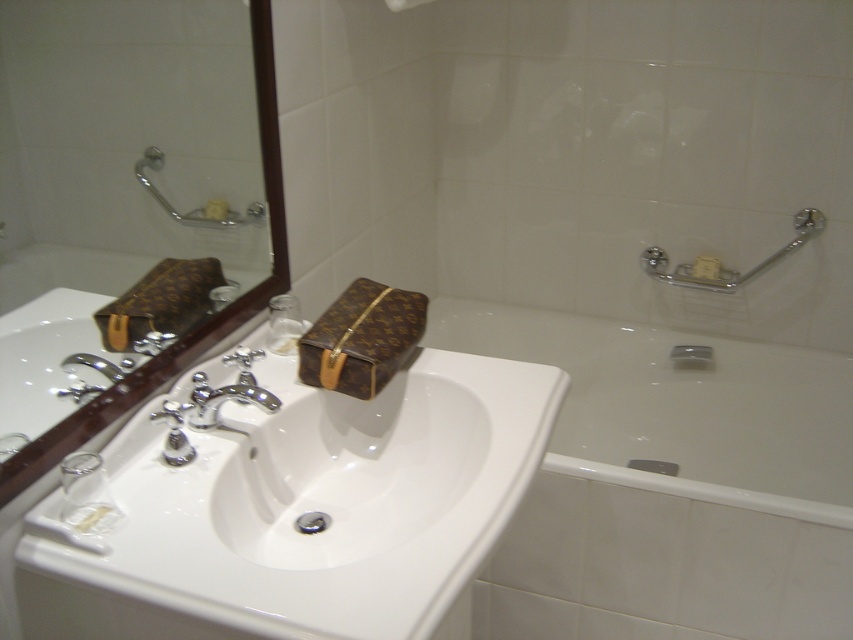
Question: Where is brown leather mirror at upper left located in relation to matte brown towel bar at upper center in the image?

Choices:
 (A) left
 (B) right

Answer: (A)

Question: Among these objects, which one is nearest to the camera?

Choices:
 (A) white matte soap at right
 (B) white glossy sink at center
 (C) chrome metallic grab bar at upper right
 (D) yellow matte soap at upper center

Answer: (B)

Question: Which of the following is the closest to the observer?

Choices:
 (A) (801, 240)
 (B) (241, 529)
 (C) (709, 260)
 (D) (387, 6)

Answer: (B)

Question: Is the position of brown leather mirror at upper left more distant than that of yellow matte soap at upper center?

Choices:
 (A) no
 (B) yes

Answer: (A)

Question: Does white glossy bathtub at lower right have a greater width compared to brown leather mirror at upper left?

Choices:
 (A) yes
 (B) no

Answer: (A)

Question: Among these points, which one is nearest to the camera?

Choices:
 (A) (811, 211)
 (B) (680, 604)

Answer: (B)